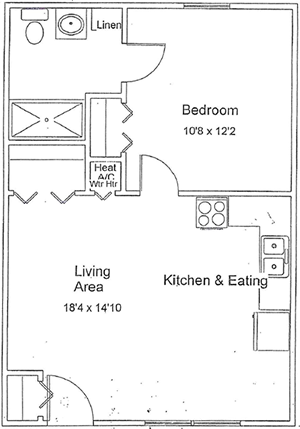
You are a GUI agent. You are given a task and a screenshot of the screen. Output one action in this format:
    pyautogui.click(x=<x>, y=<y>)
    Task: Click on the living area main
    
    Given the screenshot: What is the action you would take?
    pyautogui.click(x=79, y=326)